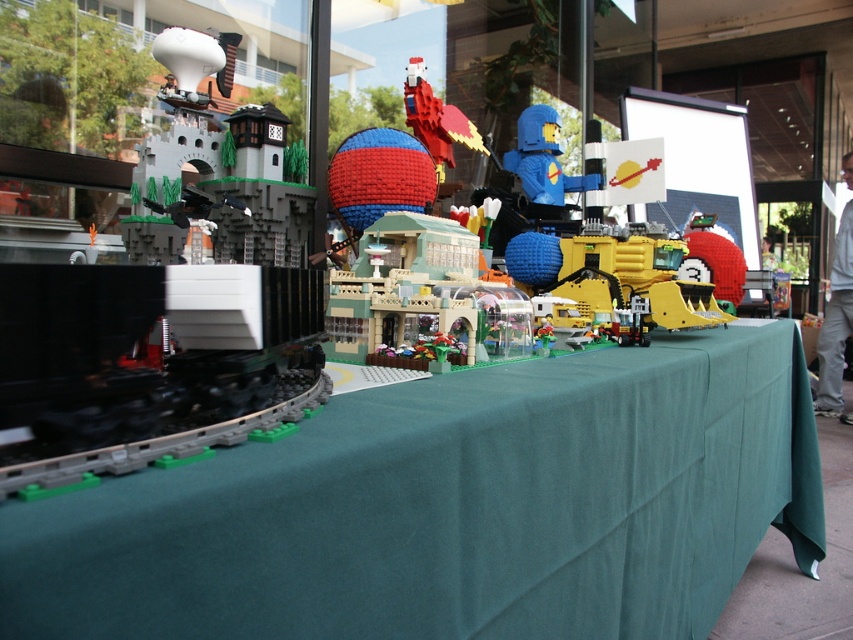
Is green fabric table at center to the left of blue matte figure at center from the viewer's perspective?

In fact, green fabric table at center is to the right of blue matte figure at center.

Image resolution: width=853 pixels, height=640 pixels. Describe the element at coordinates (453, 508) in the screenshot. I see `green fabric table at center` at that location.

Where is `green fabric table at center`? This screenshot has width=853, height=640. green fabric table at center is located at coordinates (453, 508).

Which is in front, point (329, 557) or point (436, 156)?

Point (329, 557)

What do you see at coordinates (453, 508) in the screenshot? I see `green fabric table at center` at bounding box center [453, 508].

Image resolution: width=853 pixels, height=640 pixels. I want to click on green fabric table at center, so click(453, 508).

Which is in front, point (526, 172) or point (453, 160)?

Positioned in front is point (453, 160).

Does point (538, 122) come behind point (405, 76)?

Yes, point (538, 122) is behind point (405, 76).

Identify the location of blue matte figure at center. Image resolution: width=853 pixels, height=640 pixels. (543, 157).